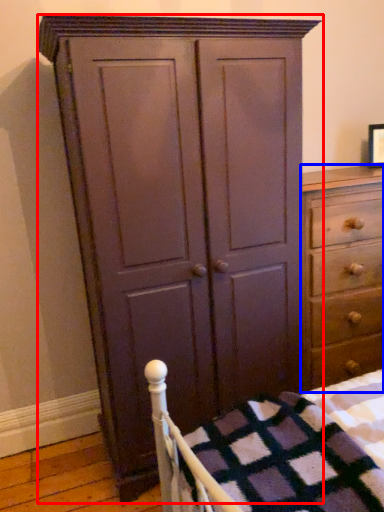
Question: Among these objects, which one is nearest to the camera, cupboard (highlighted by a red box) or chest of drawers (highlighted by a blue box)?

Choices:
 (A) cupboard
 (B) chest of drawers

Answer: (A)